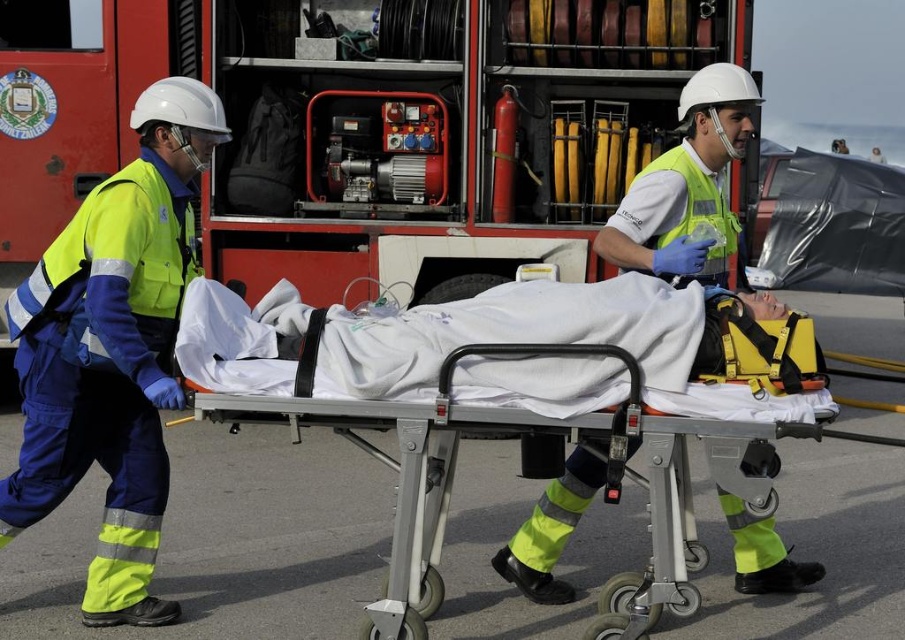
Question: Can you confirm if yellow reflective uniform at left is wider than white fabric stretcher at center?

Choices:
 (A) yes
 (B) no

Answer: (B)

Question: Which point is farther from the camera taking this photo?

Choices:
 (A) (148, 248)
 (B) (625, 298)

Answer: (A)

Question: Is yellow reflective uniform at left further to the viewer compared to white fabric stretcher at center?

Choices:
 (A) no
 (B) yes

Answer: (B)

Question: Which of the following is the farthest from the observer?

Choices:
 (A) yellow reflective uniform at left
 (B) white fabric stretcher at center

Answer: (A)

Question: Is yellow reflective uniform at left thinner than white fabric stretcher at center?

Choices:
 (A) yes
 (B) no

Answer: (A)